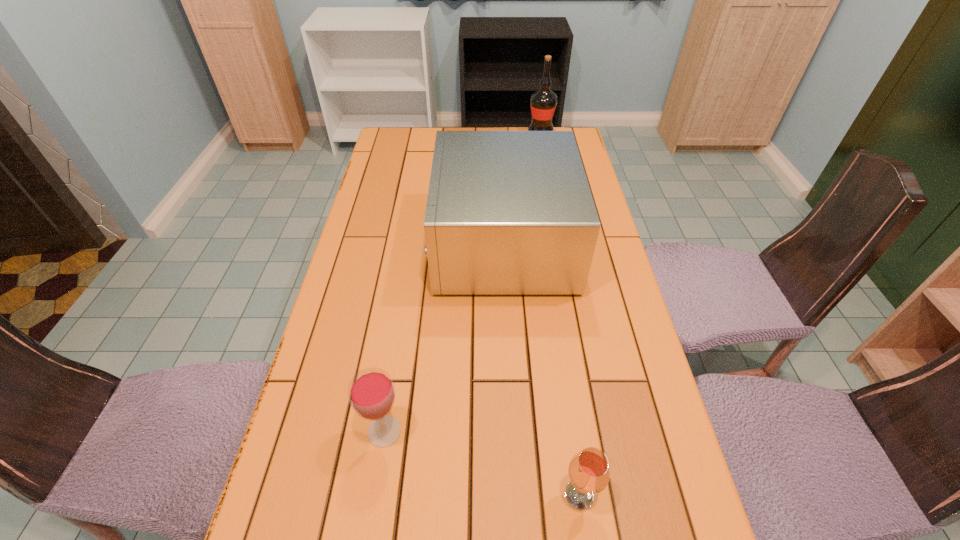
Where is `vacant space at the left edge of the desktop`? The image size is (960, 540). vacant space at the left edge of the desktop is located at coordinates (381, 274).

In the image, there is a desktop. Find the location of `vacant space at the right edge`. vacant space at the right edge is located at coordinates (607, 304).

I want to click on vacant region at the far left corner of the desktop, so click(418, 138).

Identify the location of empty location between the third farthest object and the third shortest object. (444, 337).

This screenshot has height=540, width=960. Identify the location of unoccupied area between the nearer wineglass and the second farthest object. (540, 369).

Locate an element on the screen. The height and width of the screenshot is (540, 960). free space between the farthest object and the nearer wineglass is located at coordinates (560, 314).

I want to click on free space between the second tallest object and the shortest object, so click(540, 369).

Identify the location of vacant region between the third nearest object and the second nearest object. (444, 337).

Find the location of `object that is the third closest to the second nearest object`. object that is the third closest to the second nearest object is located at coordinates (543, 102).

Select which object is the second closest to the shorter wineglass. Please provide its 2D coordinates. Your answer should be formatted as a tuple, i.e. [(x, y)], where the tuple contains the x and y coordinates of a point satisfying the conditions above.

[(508, 212)]